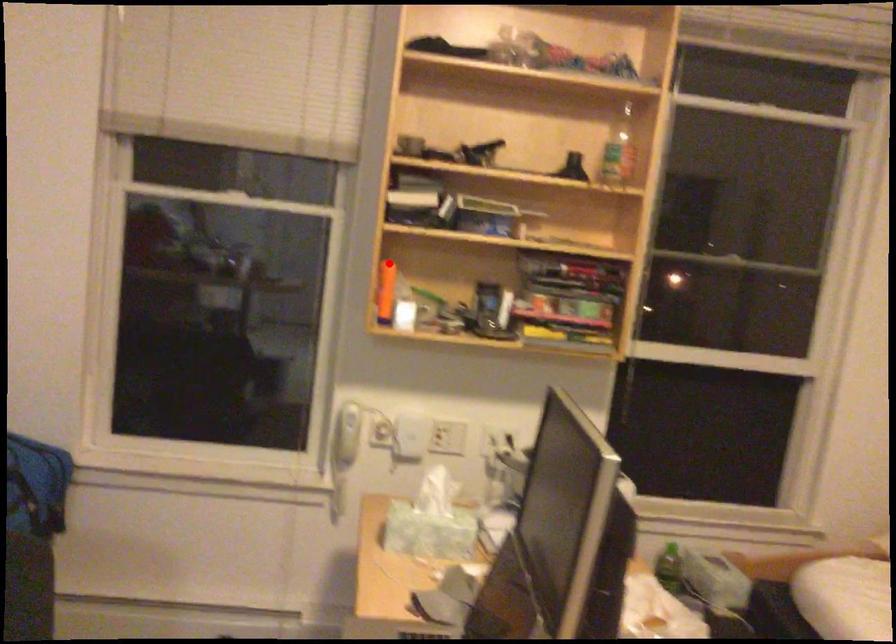
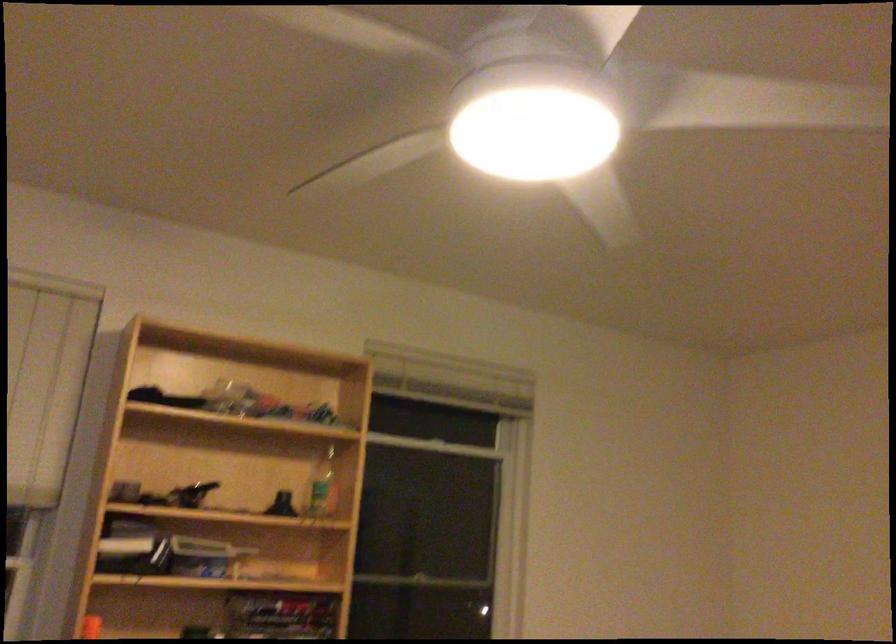
The point at the highlighted location is marked in the first image. Where is the corresponding point in the second image?

(90, 627)